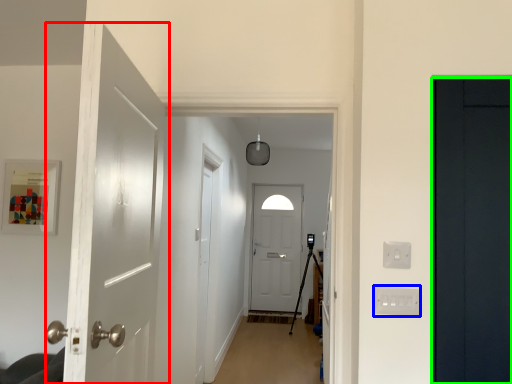
Question: Estimate the real-world distances between objects in this image. Which object is farther from door (highlighted by a red box), electric outlet (highlighted by a blue box) or door (highlighted by a green box)?

Choices:
 (A) electric outlet
 (B) door

Answer: (B)